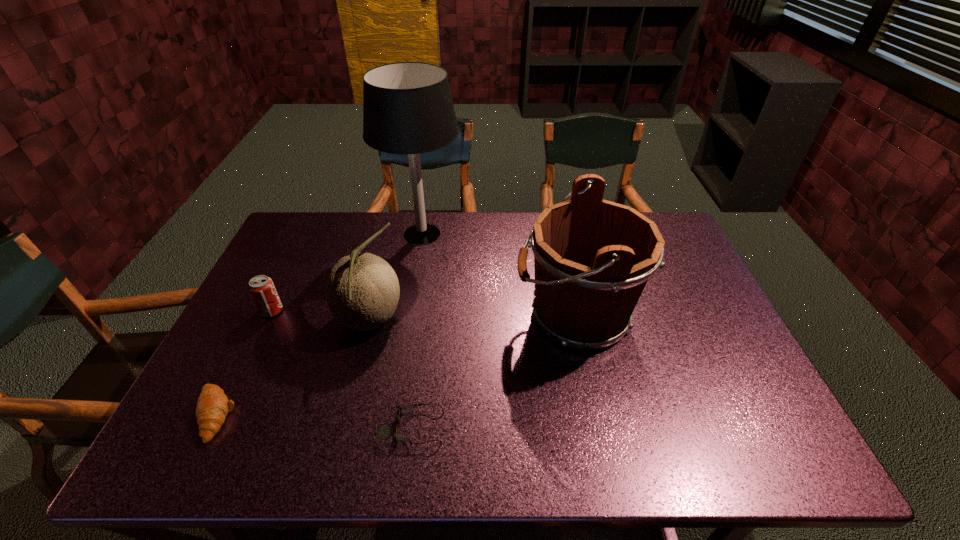
Where is `the tallest object`? the tallest object is located at coordinates coord(408,109).

Identify the location of the farthest object. (408, 109).

Locate an element on the screen. This screenshot has height=540, width=960. the rightmost object is located at coordinates (592, 258).

The image size is (960, 540). In order to click on the second tallest object in this screenshot , I will do `click(592, 258)`.

Locate an element on the screen. Image resolution: width=960 pixels, height=540 pixels. cantaloup is located at coordinates (x=362, y=291).

The width and height of the screenshot is (960, 540). In order to click on soda can in this screenshot , I will do `click(262, 289)`.

Where is `crescent roll`? This screenshot has height=540, width=960. crescent roll is located at coordinates (213, 405).

At what (x,y) coordinates should I click in order to perform the action: click on the shortest object. Please return your answer as a coordinate pair (x, y). This screenshot has height=540, width=960. Looking at the image, I should click on (384, 431).

Locate an element on the screen. vacant space located 0.190m on the right of the tallest object is located at coordinates (518, 234).

Identify the location of free space located with the handle on the side of the bucket. (413, 315).